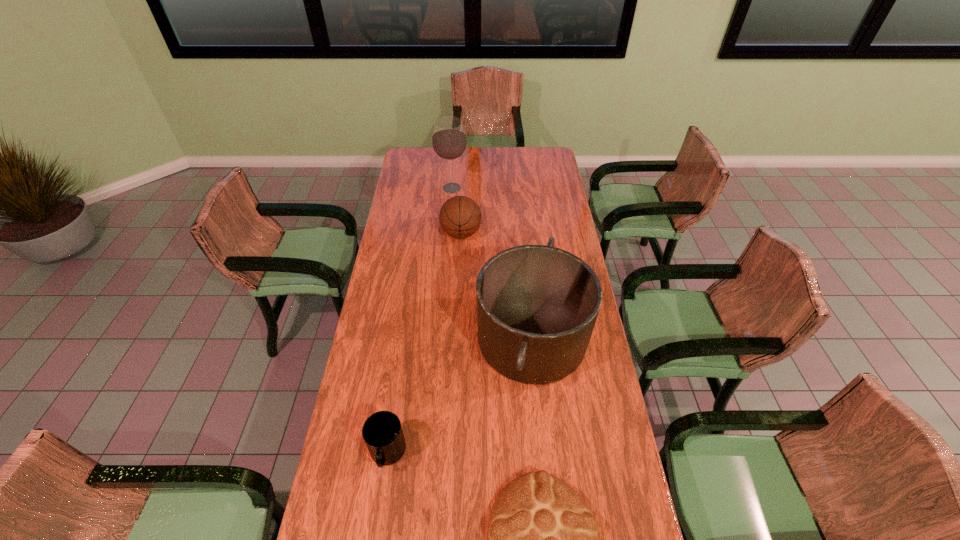
You are a GUI agent. You are given a task and a screenshot of the screen. Output one action in this format:
    pyautogui.click(x=<x>, y=<y>)
    Task: Click on the vacant position located 0.140m on the side of the mug with the handle
    The height and width of the screenshot is (540, 960).
    Given the screenshot: What is the action you would take?
    pyautogui.click(x=376, y=533)

Find the location of `object present at the left edge`. object present at the left edge is located at coordinates (382, 432).

You are a GUI agent. You are given a task and a screenshot of the screen. Output one action in this format:
    pyautogui.click(x=<x>, y=<y>)
    Task: Click on the object located in the right edge section of the desktop
    
    Given the screenshot: What is the action you would take?
    pyautogui.click(x=537, y=305)

In the image, there is a desktop. What are the coordinates of `blank space at the far edge` in the screenshot? It's located at (466, 167).

This screenshot has height=540, width=960. Find the location of `free space at the left edge of the desktop`. free space at the left edge of the desktop is located at coordinates (401, 282).

In the image, there is a desktop. What are the coordinates of `vacant space at the right edge` in the screenshot? It's located at (546, 177).

This screenshot has width=960, height=540. Find the location of `free space at the far left corner of the desktop`. free space at the far left corner of the desktop is located at coordinates (411, 160).

In order to click on blank space at the far right corner of the desktop in this screenshot , I will do `click(529, 169)`.

Locate an element on the screen. vacant area that lies between the farthest object and the mug is located at coordinates (420, 321).

The height and width of the screenshot is (540, 960). Identify the location of free spot between the pan and the mug. (460, 396).